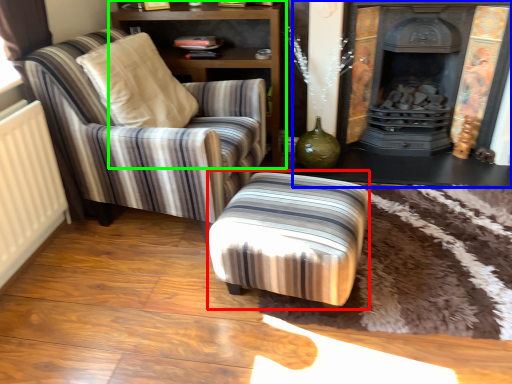
Question: Estimate the real-world distances between objects in this image. Which object is farther from stool (highlighted by a red box), fireplace (highlighted by a blue box) or shelf (highlighted by a green box)?

Choices:
 (A) fireplace
 (B) shelf

Answer: (B)